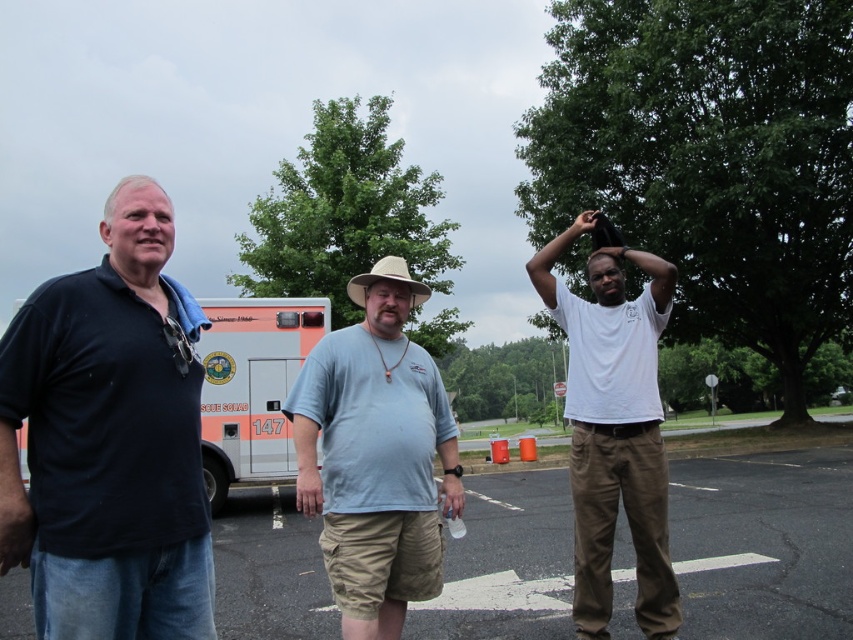
Is light blue cotton shirt at center positioned behind white matte t-shirt at center?

No, light blue cotton shirt at center is in front of white matte t-shirt at center.

Which is behind, point (383, 312) or point (611, 401)?

The point (611, 401) is behind.

Between point (425, 292) and point (550, 291), which one is positioned in front?

Point (425, 292)

Identify the location of light blue cotton shirt at center. (375, 456).

Is white matte t-shirt at center wider than white glossy ambulance at center?

No.

Measure the distance between white matte t-shirt at center and camera.

The distance of white matte t-shirt at center from camera is 3.92 meters.

The width and height of the screenshot is (853, 640). I want to click on white matte t-shirt at center, so click(614, 428).

Is point (68, 278) positioned before point (250, 451)?

Yes, it is in front of point (250, 451).

Where is `dark blue cotton shirt at left`? The width and height of the screenshot is (853, 640). dark blue cotton shirt at left is located at coordinates (109, 440).

Between point (131, 637) and point (281, 356), which one is positioned in front?

Point (131, 637) is in front.

The width and height of the screenshot is (853, 640). Identify the location of dark blue cotton shirt at left. (109, 440).